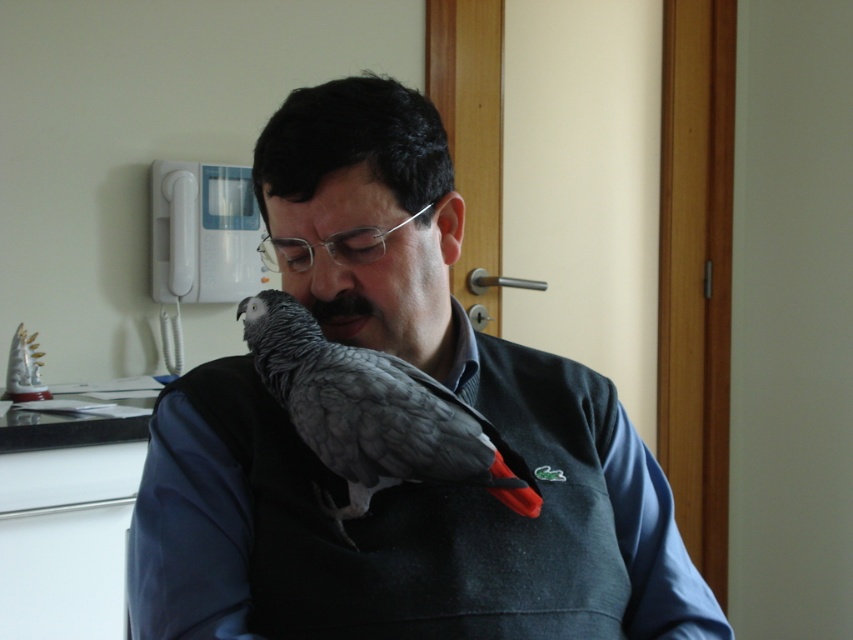
Does matte gray bird at center appear on the right side of gray matte parrot at center?

Indeed, matte gray bird at center is positioned on the right side of gray matte parrot at center.

Is matte gray bird at center shorter than gray matte parrot at center?

No, matte gray bird at center is not shorter than gray matte parrot at center.

In order to click on matte gray bird at center in this screenshot , I will do `click(403, 484)`.